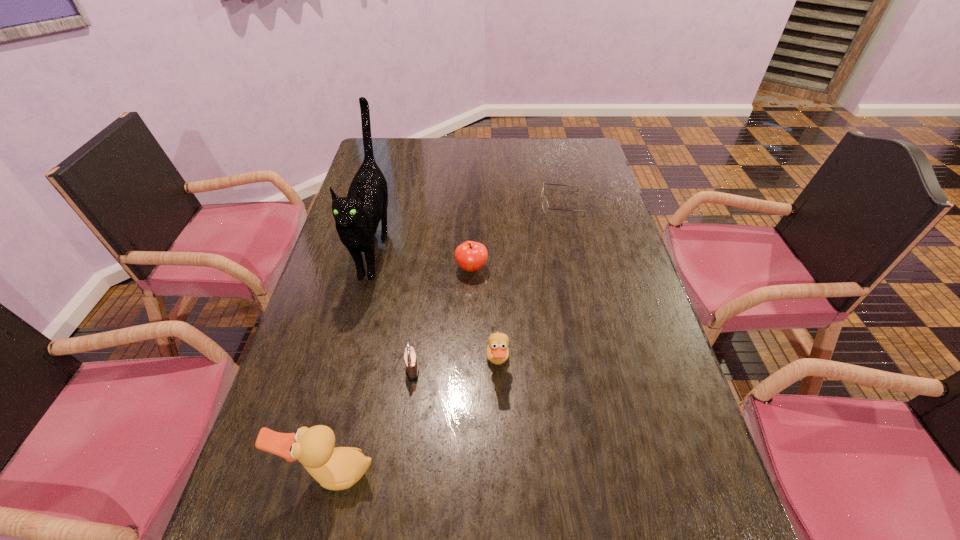
Given the evenly spaced ducks in the image, where should an extra duck be added on the right to preserve the spacing? Please point to a vacant space. Please provide its 2D coordinates. Your answer should be formatted as a tuple, i.e. [(x, y)], where the tuple contains the x and y coordinates of a point satisfying the conditions above.

[(614, 285)]